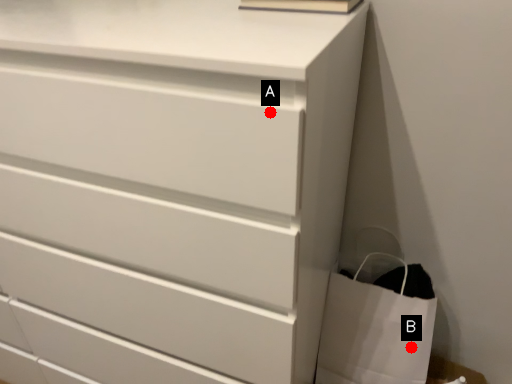
Question: Two points are circled on the image, labeled by A and B beside each circle. Which point is farther to the camera?

Choices:
 (A) A is further
 (B) B is further

Answer: (B)